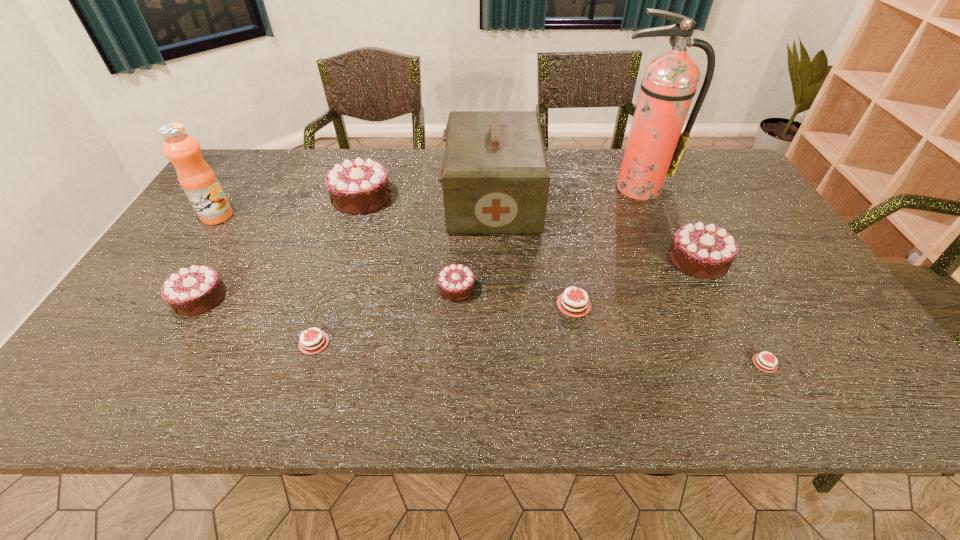
Select which red chocolate cake is the third closest to the sixth tallest object. Please provide its 2D coordinates. Your answer should be formatted as a tuple, i.e. [(x, y)], where the tuple contains the x and y coordinates of a point satisfying the conditions above.

[(658, 376)]

The width and height of the screenshot is (960, 540). I want to click on red chocolate cake object that ranks as the second closest to the smallest red chocolate cake, so click(x=658, y=376).

What are the coordinates of `vacant region that satisfies the following two spatial constraints: 1. on the front side of the fourth shortest object; 2. on the left side of the shortest object` in the screenshot? It's located at (453, 363).

Image resolution: width=960 pixels, height=540 pixels. I want to click on free space that satisfies the following two spatial constraints: 1. at the nozzle of the fifth tallest object; 2. on the right side of the tallest object, so click(666, 260).